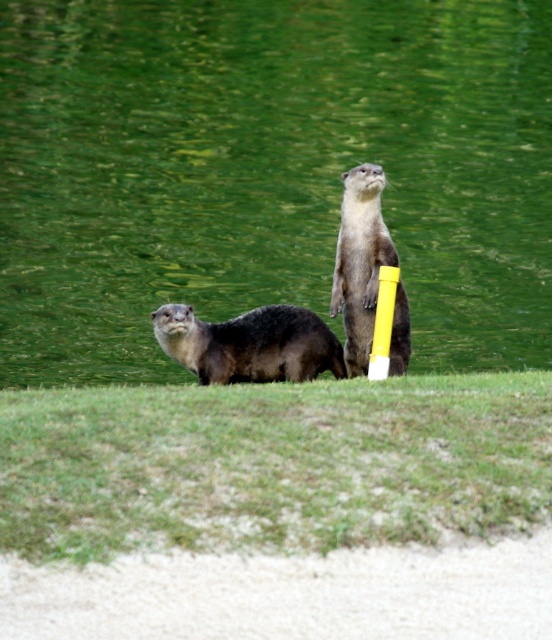
Based on the scene, where is the shiny brown otter at center located in terms of its 2D coordinates?

The shiny brown otter at center is located at the 2D coordinates of point (x=250, y=344).

You are a photographer trying to capture both the green water at center and the soft brown fur otter at center in a single shot. Based on their positions, which object should you adjust your camera focus to first to ensure both are in frame?

The green water at center is positioned on the left side of soft brown fur otter at center. To capture both in a single shot, focus on the soft brown fur otter at center first since it is closer to the right side, allowing you to adjust the frame to include the green water at center on its left.